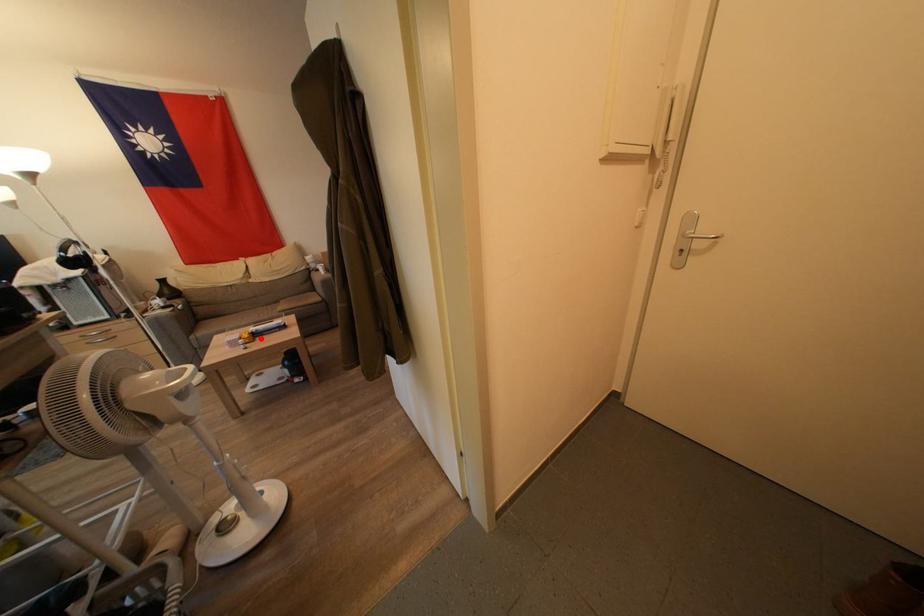
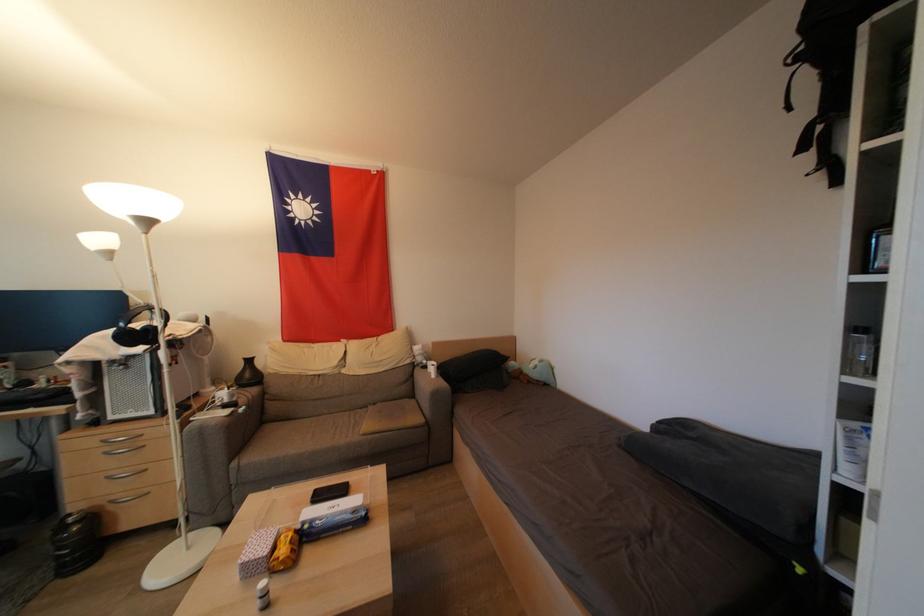
Locate, in the second image, the point that corresponds to the highlighted location in the first image.

(310, 541)